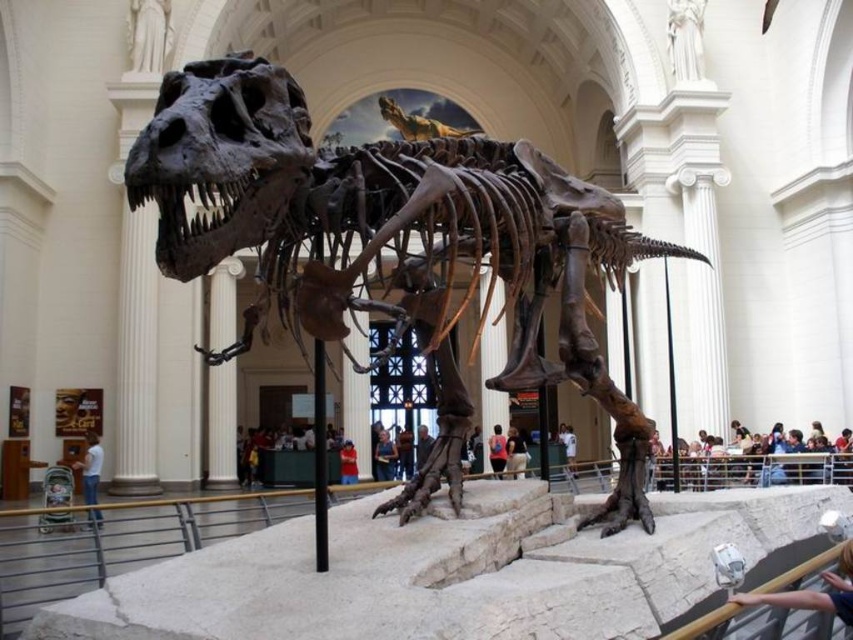
You are a visitor in the museum and want to take a photo of both the denim jacket at center and the white cotton shirt at center. Since you can only focus on one item at a time, which item should you focus on first to ensure the other is still in the frame?

The denim jacket at center is below the white cotton shirt at center, so you should focus on the white cotton shirt at center first to ensure the denim jacket at center remains in the frame.

You are a museum visitor standing in front of the T. rex skeleton. You notice two items at the center of the display area. Which item is narrower in width between the denim jacket at center and the white cotton shirt at center?

The denim jacket at center is thinner than the white cotton shirt at center, so the denim jacket at center is narrower in width.